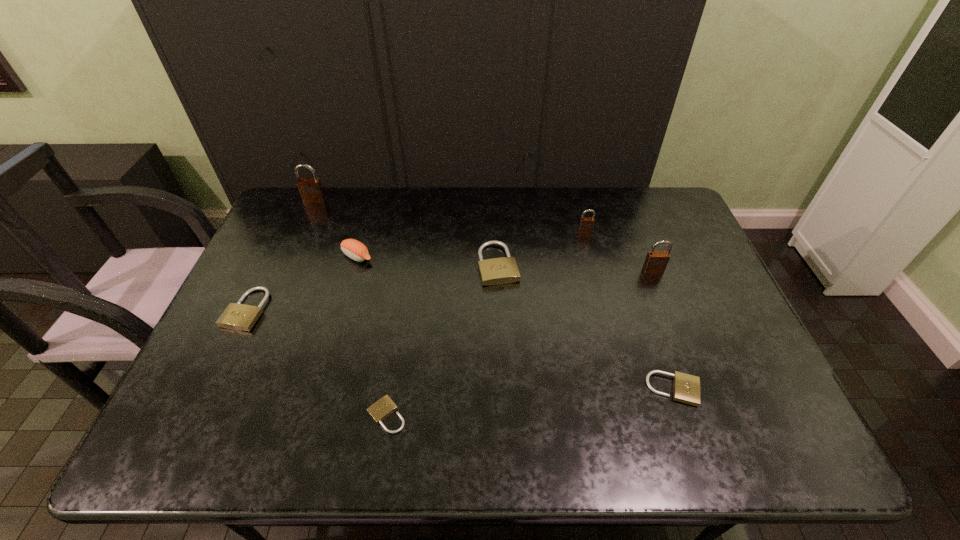
At what (x,y) coordinates should I click in order to perform the action: click on vacant space at the right edge of the desktop. Please return your answer as a coordinate pair (x, y). Looking at the image, I should click on (668, 300).

The height and width of the screenshot is (540, 960). In the image, there is a desktop. Identify the location of vacant space at the far left corner. (298, 188).

Where is `blank space at the far right corner of the desktop`? This screenshot has width=960, height=540. blank space at the far right corner of the desktop is located at coordinates (681, 219).

The image size is (960, 540). I want to click on vacant space at the near right corner of the desktop, so click(x=727, y=443).

Where is `free space between the rightmost beige padlock and the tallest padlock`? This screenshot has width=960, height=540. free space between the rightmost beige padlock and the tallest padlock is located at coordinates (494, 295).

Locate an element on the screen. This screenshot has width=960, height=540. unoccupied position between the tallest object and the salmon sushi is located at coordinates (336, 228).

You are a GUI agent. You are given a task and a screenshot of the screen. Output one action in this format:
    pyautogui.click(x=<x>, y=<y>)
    Task: Click on the unoccupied area between the farthest beige padlock and the smallest beige padlock
    
    Given the screenshot: What is the action you would take?
    pyautogui.click(x=443, y=340)

This screenshot has width=960, height=540. I want to click on free spot between the tallest padlock and the fifth shortest object, so click(x=336, y=228).

Identify the location of unoccupied area between the sixth tallest object and the seventh tallest object. This screenshot has height=540, width=960. (460, 349).

Identify the location of free space between the sixth farthest object and the smallest beige padlock. (317, 362).